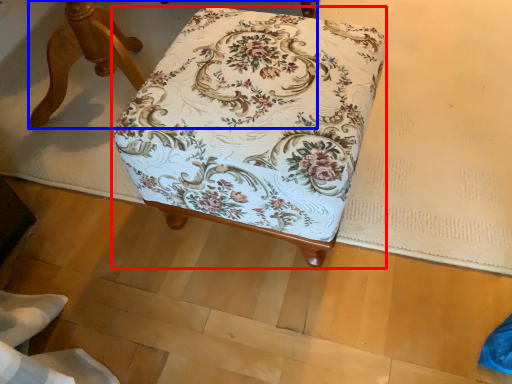
Question: Which point is closer to the camera, furniture (highlighted by a red box) or furniture (highlighted by a blue box)?

Choices:
 (A) furniture
 (B) furniture

Answer: (A)